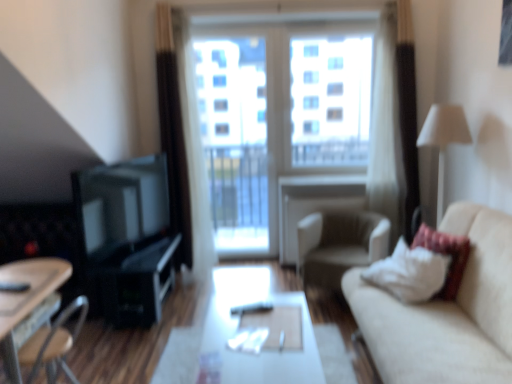
Question: Would you say white soft pillow at right contains beige fabric armchair at center?

Choices:
 (A) yes
 (B) no

Answer: (B)

Question: Can you confirm if white soft pillow at right is wider than beige fabric armchair at center?

Choices:
 (A) yes
 (B) no

Answer: (B)

Question: Is white soft pillow at right behind beige fabric armchair at center?

Choices:
 (A) yes
 (B) no

Answer: (B)

Question: Does white soft pillow at right have a larger size compared to beige fabric armchair at center?

Choices:
 (A) no
 (B) yes

Answer: (A)

Question: Is white soft pillow at right in contact with beige fabric armchair at center?

Choices:
 (A) no
 (B) yes

Answer: (A)

Question: Can you confirm if white soft pillow at right is positioned to the left of beige fabric armchair at center?

Choices:
 (A) no
 (B) yes

Answer: (A)

Question: Is white fabric lampshade at right surrounding transparent glass window at center?

Choices:
 (A) yes
 (B) no

Answer: (B)

Question: From the image's perspective, would you say white fabric lampshade at right is shown under transparent glass window at center?

Choices:
 (A) yes
 (B) no

Answer: (A)

Question: From the image's perspective, is white fabric lampshade at right located above transparent glass window at center?

Choices:
 (A) no
 (B) yes

Answer: (A)

Question: Is white fabric lampshade at right smaller than transparent glass window at center?

Choices:
 (A) yes
 (B) no

Answer: (A)

Question: Is white fabric lampshade at right facing towards transparent glass window at center?

Choices:
 (A) yes
 (B) no

Answer: (B)

Question: Is white fabric lampshade at right at the right side of transparent glass window at center?

Choices:
 (A) yes
 (B) no

Answer: (A)

Question: Considering the relative sizes of matte black entertainment center at left and wooden table at lower left, arranged as the first table when viewed from the left, in the image provided, is matte black entertainment center at left thinner than wooden table at lower left, arranged as the first table when viewed from the left,?

Choices:
 (A) no
 (B) yes

Answer: (B)